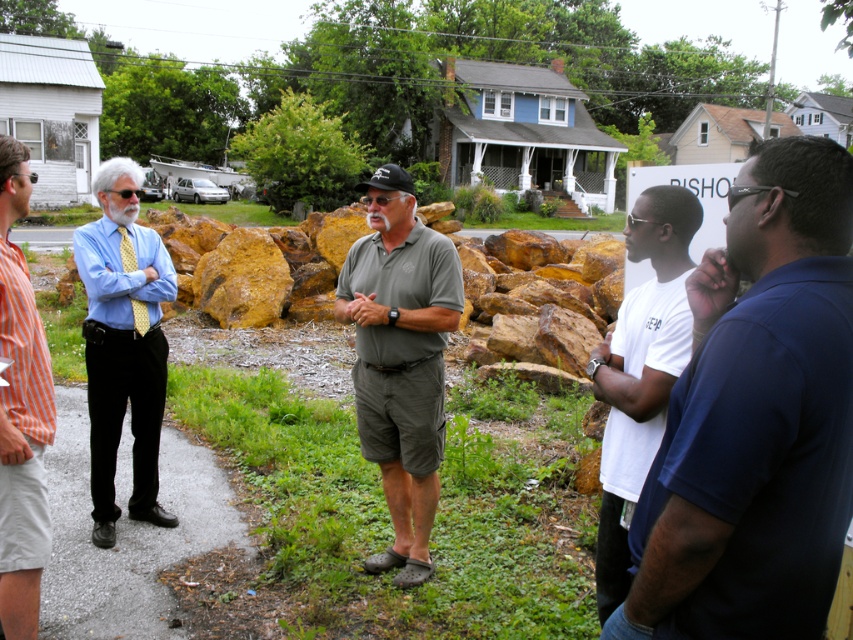
Is dark green fabric shirt at center below blue shirt at left?

Yes.

Who is more forward, (434, 428) or (91, 368)?

Point (434, 428)

Is point (442, 444) positioned behind point (144, 460)?

No.

Where is `dark green fabric shirt at center`? This screenshot has width=853, height=640. dark green fabric shirt at center is located at coordinates (399, 358).

Between dark blue shirt at right and orange striped shirt at left, which one appears on the left side from the viewer's perspective?

orange striped shirt at left is more to the left.

Does point (799, 348) come farther from viewer compared to point (1, 253)?

No, it is in front of (1, 253).

The width and height of the screenshot is (853, 640). Identify the location of dark blue shirt at right. (756, 417).

Which is behind, point (786, 209) or point (390, 278)?

Point (390, 278)

Which is more to the left, dark blue shirt at right or dark green fabric shirt at center?

dark green fabric shirt at center

Between point (793, 291) and point (397, 486), which one is positioned behind?

The point (397, 486) is behind.

In order to click on dark blue shirt at right in this screenshot , I will do `click(756, 417)`.